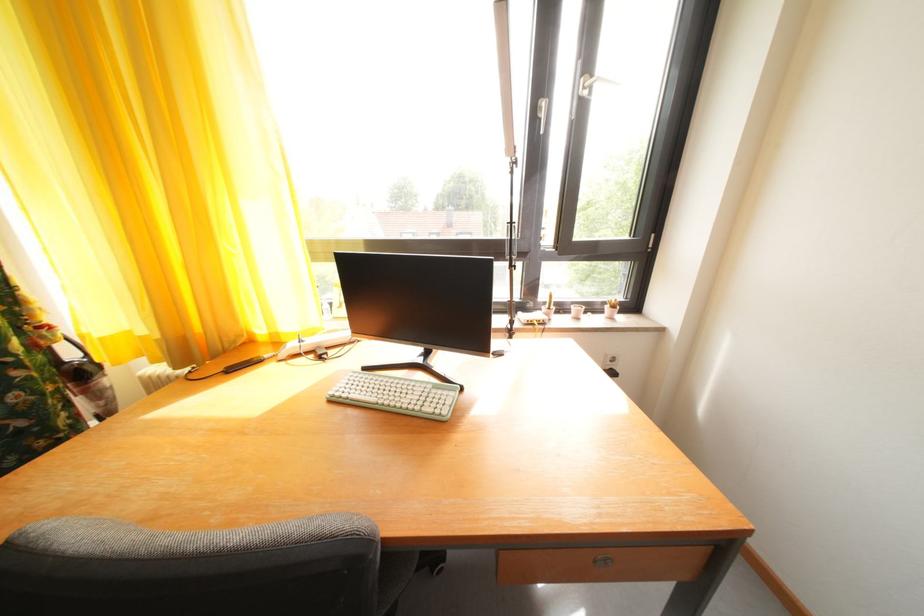
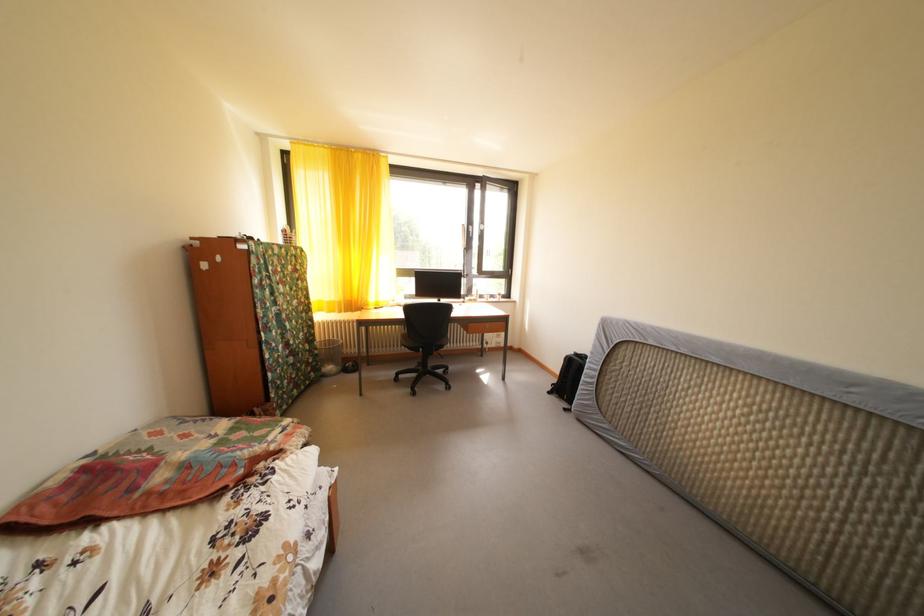
Question: Which direction would the cameraman need to move to produce the second image? Reply with the corresponding letter.

Choices:
 (A) Left
 (B) Right
 (C) Forward
 (D) Backward

Answer: (D)